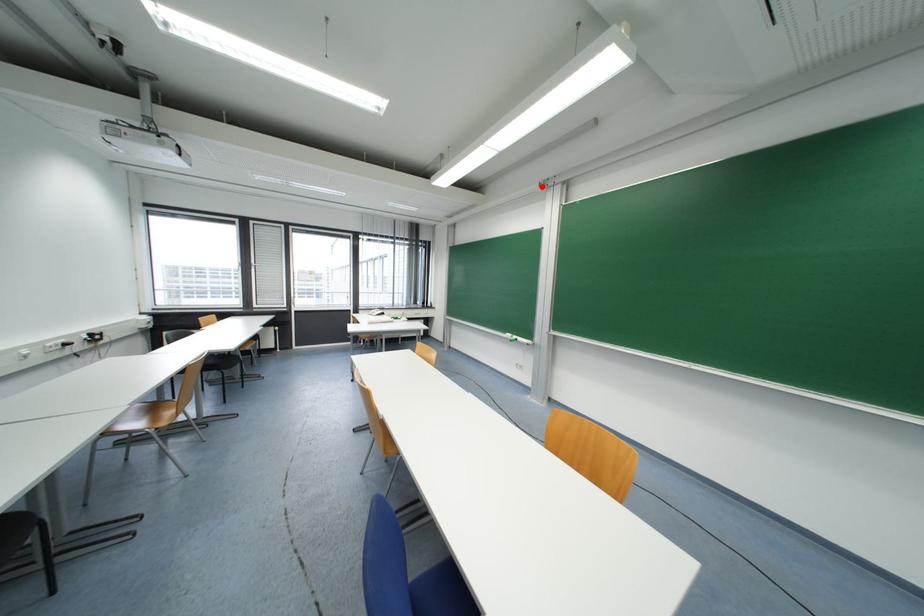
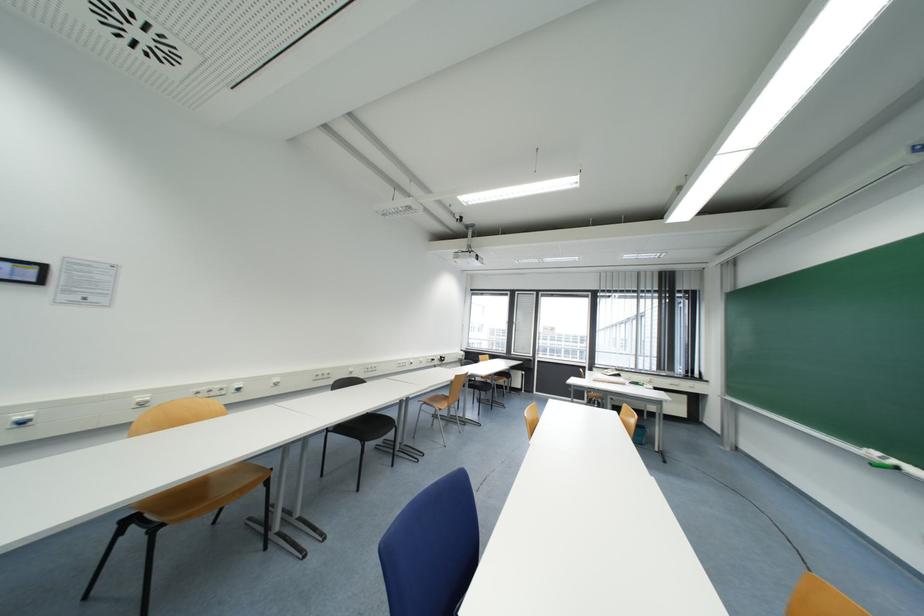
Where in the second image is the point corresponding to the highlighted location from the first image?

(909, 154)